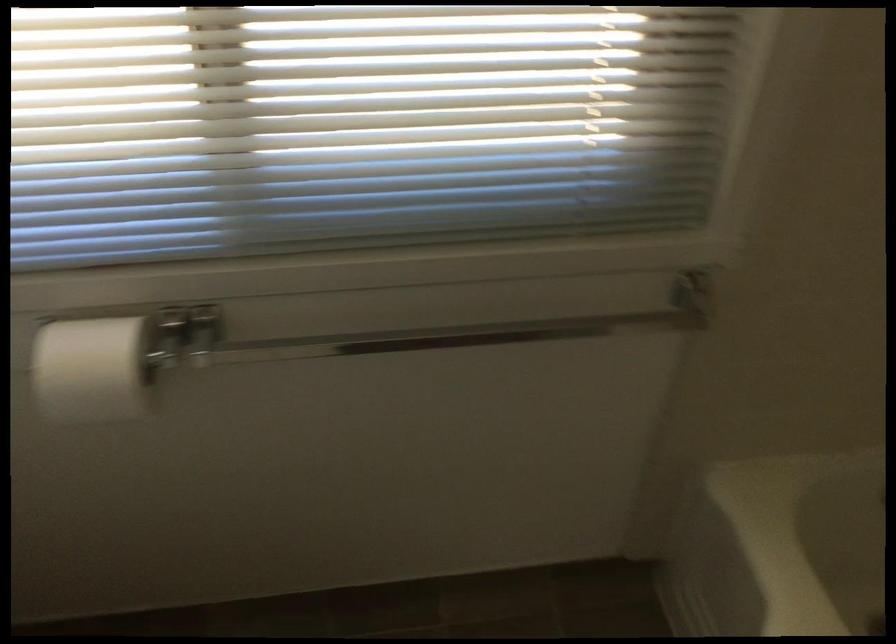
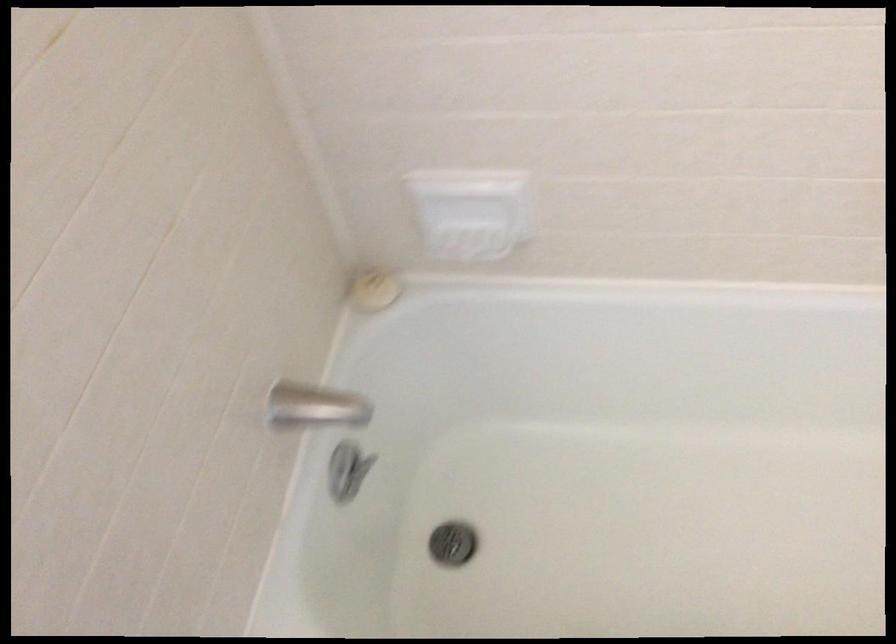
Based on the continuous images, in which direction is the camera rotating?

The camera rotated toward right-down.